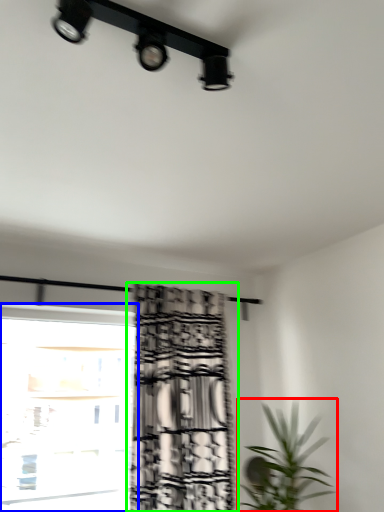
Question: Which object is the farthest from houseplant (highlighted by a red box)? Choose among these: window (highlighted by a blue box) or curtain (highlighted by a green box).

Choices:
 (A) window
 (B) curtain

Answer: (A)